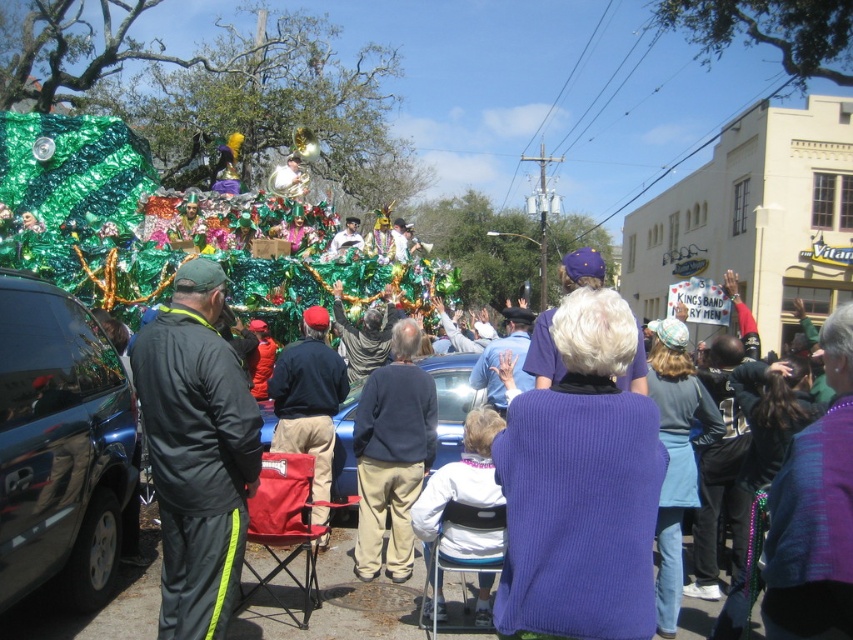
Question: Which point is closer to the camera?

Choices:
 (A) (20, 96)
 (B) (321, 486)
 (C) (817, 68)
 (D) (642, 400)

Answer: (D)

Question: Which object is farther from the camera taking this photo?

Choices:
 (A) green shiny tinsel at center
 (B) khaki pants at center
 (C) green shiny tinsel at upper left

Answer: (C)

Question: Is purple ribbed sweater at center to the left of white fleece jacket at center from the viewer's perspective?

Choices:
 (A) yes
 (B) no

Answer: (B)

Question: Does green shiny tinsel at center appear under khaki pants at center?

Choices:
 (A) no
 (B) yes

Answer: (A)

Question: Which point is farther from the camera taking this photo?

Choices:
 (A) (367, 372)
 (B) (704, 60)
 (C) (413, 406)

Answer: (B)

Question: Does green shiny tinsel at center appear over blue metallic car at center?

Choices:
 (A) yes
 (B) no

Answer: (A)